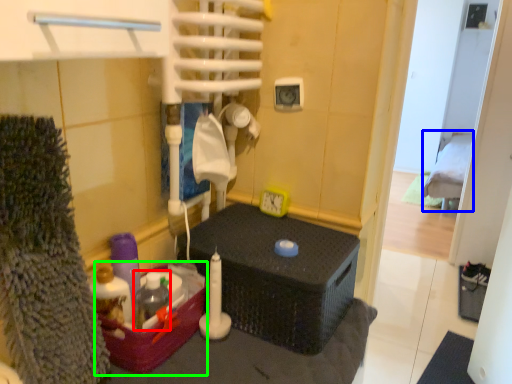
Question: Which object is the closest to the bottle (highlighted by a red box)? Choose among these: bed (highlighted by a blue box) or box (highlighted by a green box).

Choices:
 (A) bed
 (B) box

Answer: (B)